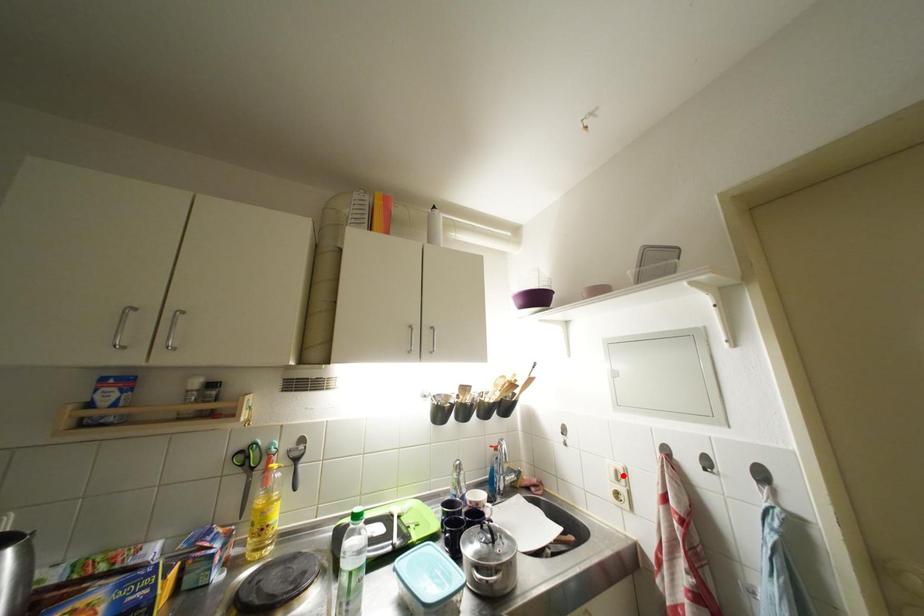
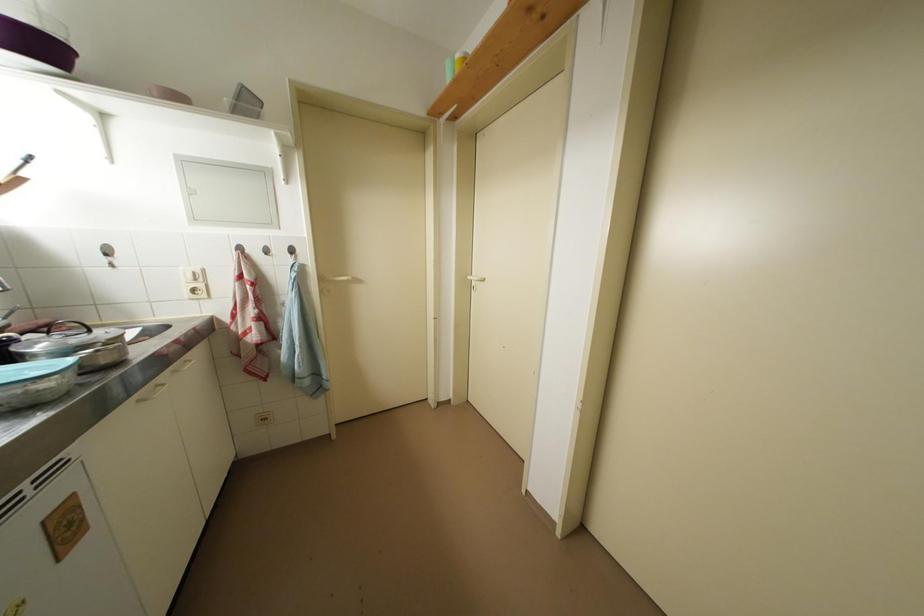
Find the pixel in the second image that matches the highlighted location in the first image.

(201, 277)